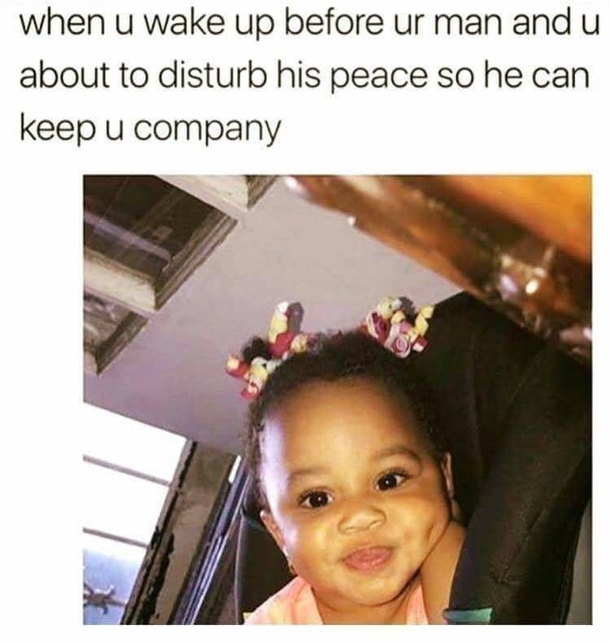
Find the location of `window`. window is located at coordinates (132, 443).